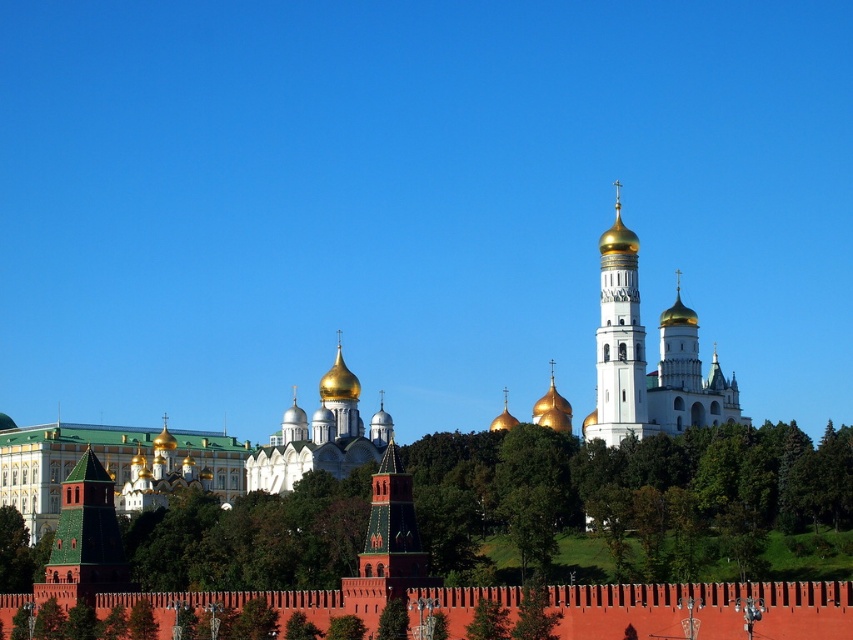
Question: Can you confirm if green tiled tower at lower left is positioned to the right of green tiled tower at center?

Choices:
 (A) yes
 (B) no

Answer: (B)

Question: Does green tiled tower at center lie in front of green leafy tree at center?

Choices:
 (A) no
 (B) yes

Answer: (A)

Question: Which object is closer to the camera taking this photo?

Choices:
 (A) green tiled tower at center
 (B) green leafy tree at center
 (C) white stone church at center

Answer: (B)

Question: Is white stone church at center in front of green tiled tower at center?

Choices:
 (A) yes
 (B) no

Answer: (B)

Question: Among these objects, which one is nearest to the camera?

Choices:
 (A) green leafy tree at center
 (B) gold domed tower at center right

Answer: (A)

Question: Considering the real-world distances, which object is closest to the green leafy tree at center?

Choices:
 (A) green tiled tower at lower left
 (B) gold domed tower at center right
 (C) green tiled tower at center
 (D) white stone church at center

Answer: (C)